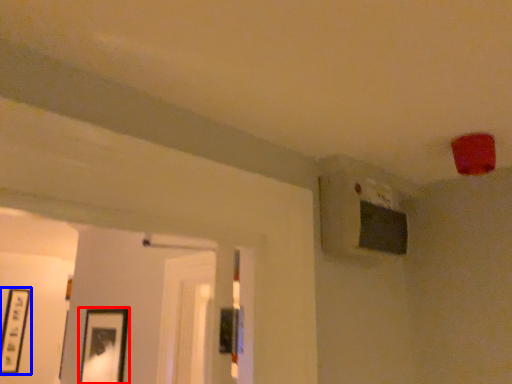
Question: Which object is closer to the camera taking this photo, picture frame (highlighted by a red box) or picture frame (highlighted by a blue box)?

Choices:
 (A) picture frame
 (B) picture frame

Answer: (A)